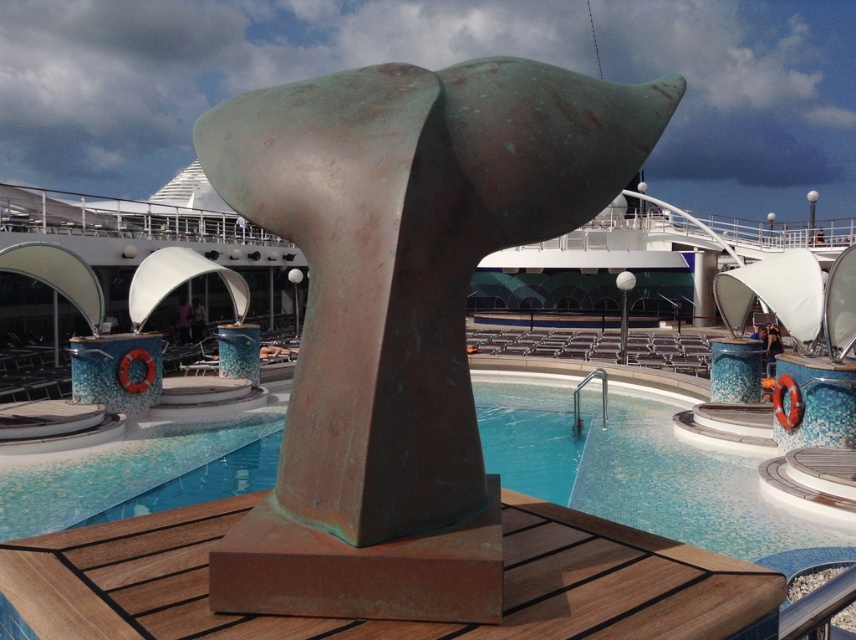
Who is positioned more to the right, green patina sculpture at center or rustic wood deck at center?

From the viewer's perspective, green patina sculpture at center appears more on the right side.

Is point (313, 582) behind point (197, 532)?

No, it is not.

What are the coordinates of `green patina sculpture at center` in the screenshot? It's located at pyautogui.click(x=402, y=310).